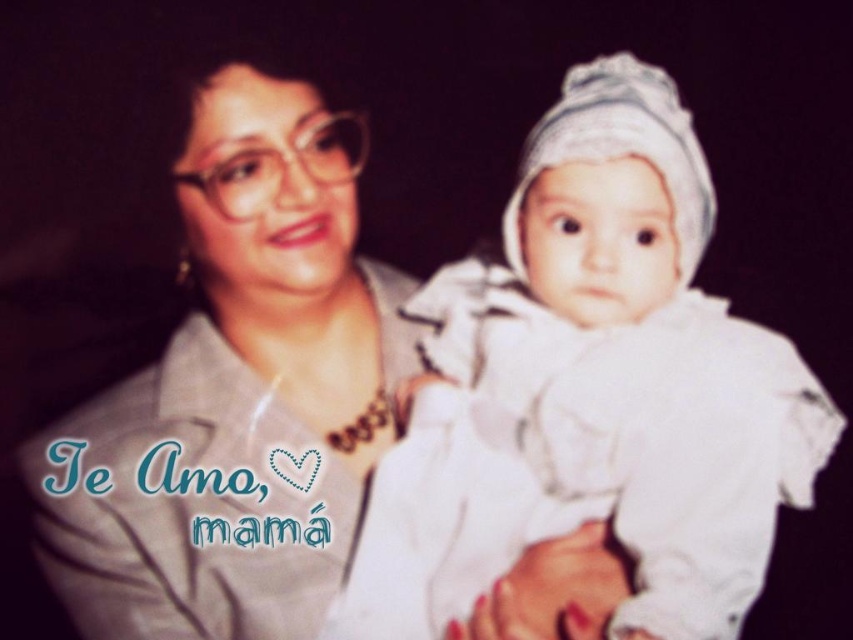
Question: Can you confirm if white soft cloth at center is positioned below matte gray shirt at center?

Choices:
 (A) no
 (B) yes

Answer: (B)

Question: Which object appears farthest from the camera in this image?

Choices:
 (A) matte gray shirt at center
 (B) white soft cloth at center

Answer: (A)

Question: Which point appears farthest from the camera in this image?

Choices:
 (A) (380, 413)
 (B) (495, 378)

Answer: (A)

Question: Which object appears farthest from the camera in this image?

Choices:
 (A) white soft cloth at center
 (B) matte gray shirt at center

Answer: (B)

Question: Does white soft cloth at center have a larger size compared to matte gray shirt at center?

Choices:
 (A) no
 (B) yes

Answer: (B)

Question: Is white soft cloth at center further to the viewer compared to matte gray shirt at center?

Choices:
 (A) yes
 (B) no

Answer: (B)